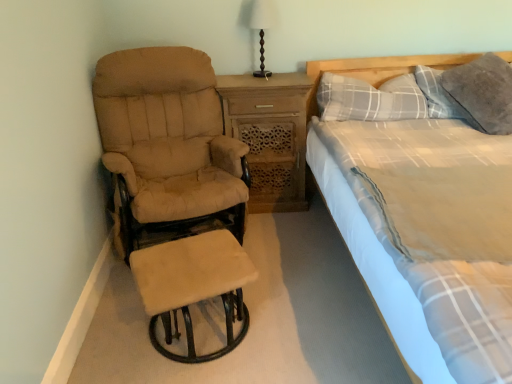
The image size is (512, 384). I want to click on vacant area on top of beige suede stool at lower left (from a real-world perspective), so click(184, 271).